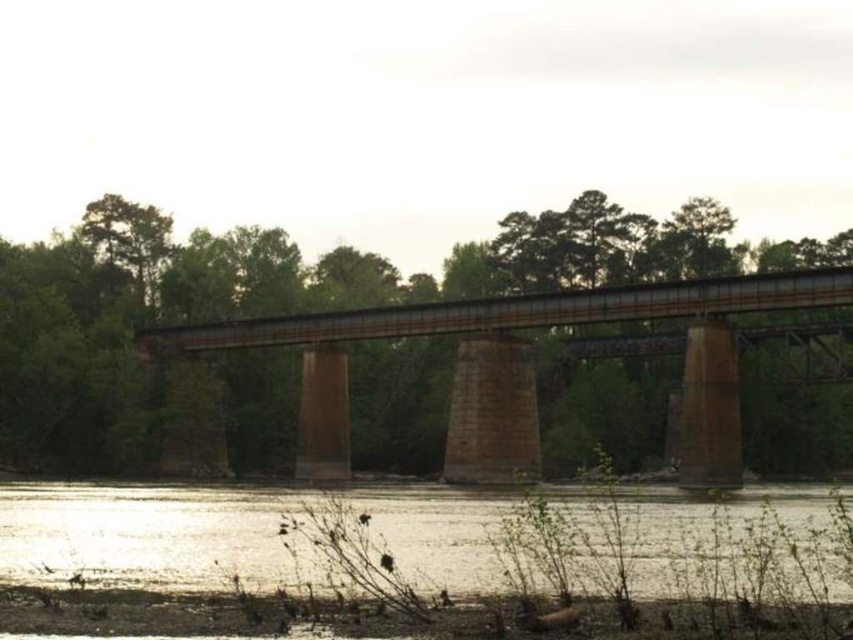
Who is shorter, silvery reflective water at lower center or rusty metal bridge at center?

silvery reflective water at lower center

Is point (212, 547) closer to viewer compared to point (325, 476)?

Yes, point (212, 547) is in front of point (325, 476).

What do you see at coordinates (142, 531) in the screenshot? I see `silvery reflective water at lower center` at bounding box center [142, 531].

Identify the location of silvery reflective water at lower center. The image size is (853, 640). (142, 531).